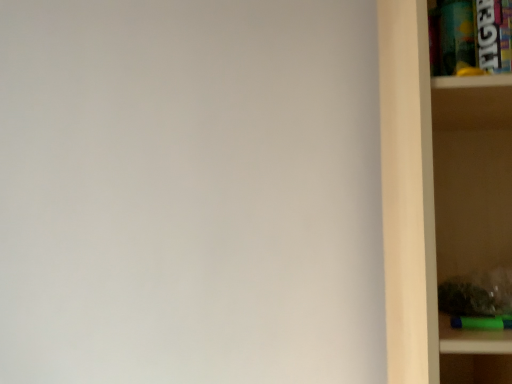
Question: Considering the positions of wooden shelf at right and metallic plastic cabinet at upper right in the image, is wooden shelf at right bigger or smaller than metallic plastic cabinet at upper right?

Choices:
 (A) small
 (B) big

Answer: (B)

Question: Is wooden shelf at right inside or outside of metallic plastic cabinet at upper right?

Choices:
 (A) inside
 (B) outside

Answer: (B)

Question: Is wooden shelf at right to the left or to the right of metallic plastic cabinet at upper right in the image?

Choices:
 (A) left
 (B) right

Answer: (B)

Question: Choose the correct answer: Is metallic plastic cabinet at upper right inside wooden shelf at right or outside it?

Choices:
 (A) outside
 (B) inside

Answer: (B)

Question: From a real-world perspective, is metallic plastic cabinet at upper right physically located above or below wooden shelf at right?

Choices:
 (A) above
 (B) below

Answer: (A)

Question: Considering the positions of metallic plastic cabinet at upper right and wooden shelf at right in the image, is metallic plastic cabinet at upper right bigger or smaller than wooden shelf at right?

Choices:
 (A) small
 (B) big

Answer: (A)

Question: From the image's perspective, is metallic plastic cabinet at upper right located above or below wooden shelf at right?

Choices:
 (A) above
 (B) below

Answer: (A)